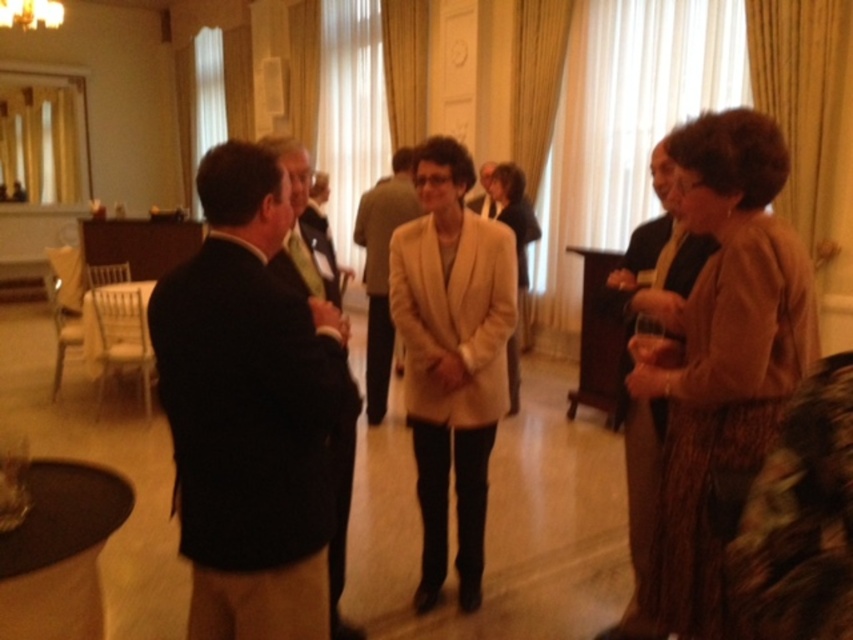
Question: Which object appears farthest from the camera in this image?

Choices:
 (A) beige woolen blazer at center
 (B) beige fabric coat at center

Answer: (B)

Question: Can you confirm if beige woolen blazer at center is wider than beige fabric coat at center?

Choices:
 (A) no
 (B) yes

Answer: (B)

Question: Is dark suit jacket at left bigger than dark suit jacket at center?

Choices:
 (A) no
 (B) yes

Answer: (B)

Question: Considering the real-world distances, which object is closest to the matte black suit at center?

Choices:
 (A) light beige suit at center
 (B) light brown textured blazer at right
 (C) dark suit jacket at center
 (D) beige fabric coat at center

Answer: (D)

Question: Which of the following is the closest to the observer?

Choices:
 (A) matte black suit at center
 (B) dark suit jacket at center
 (C) light brown textured blazer at right

Answer: (C)

Question: Can you confirm if matte brown suit at right is wider than beige fabric coat at center?

Choices:
 (A) yes
 (B) no

Answer: (B)